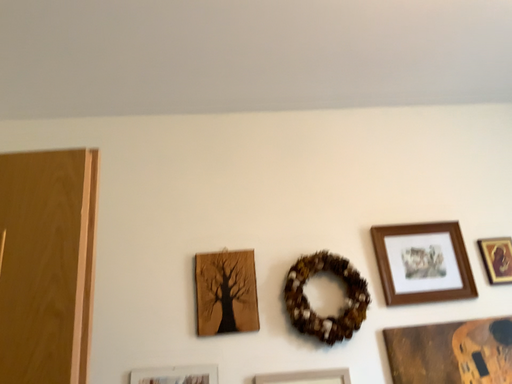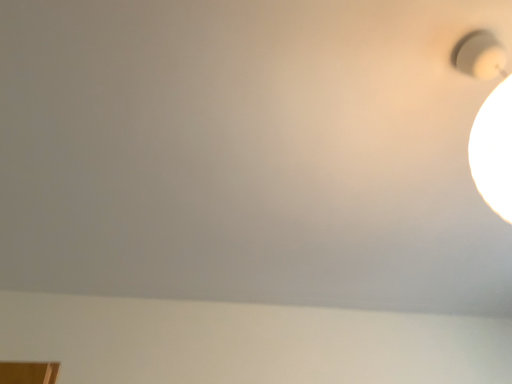
Question: Which way did the camera rotate in the video?

Choices:
 (A) rotated downward
 (B) rotated upward

Answer: (B)